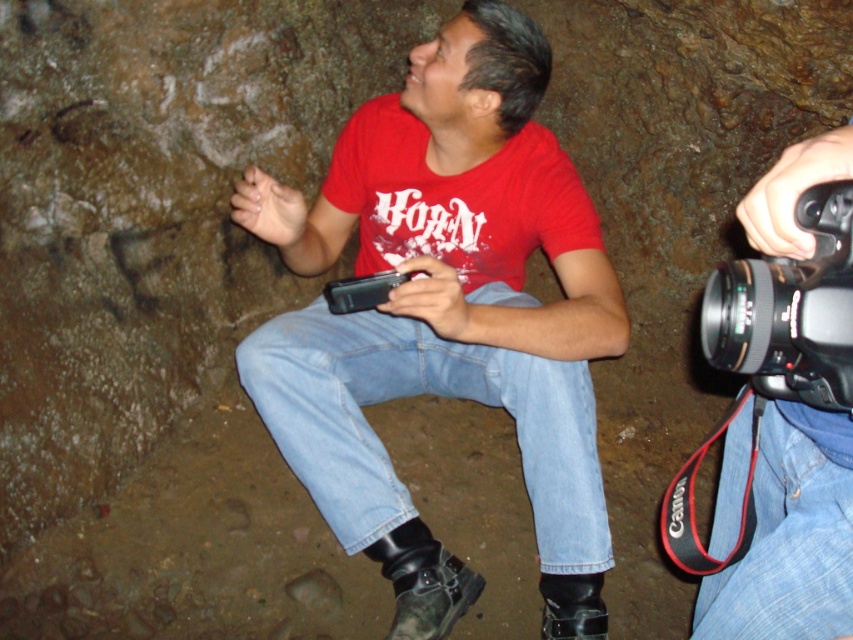
Question: Considering the real-world distances, which object is closest to the blue denim jeans at center?

Choices:
 (A) matte red t-shirt at center
 (B) blue denim jeans at lower right
 (C) black rubber boots at lower center

Answer: (A)

Question: Which object is farther from the camera taking this photo?

Choices:
 (A) black rubber boots at lower center
 (B) blue denim jeans at lower right

Answer: (B)

Question: Among these points, which one is farthest from the camera?

Choices:
 (A) (320, 380)
 (B) (730, 480)
 (C) (421, 52)

Answer: (C)

Question: Can you confirm if matte red t-shirt at center is positioned below blue denim jeans at center?

Choices:
 (A) no
 (B) yes

Answer: (A)

Question: Can you confirm if blue denim jeans at center is positioned to the left of black plastic camera at right?

Choices:
 (A) yes
 (B) no

Answer: (A)

Question: Is blue denim jeans at lower right thinner than black plastic camera at right?

Choices:
 (A) yes
 (B) no

Answer: (A)